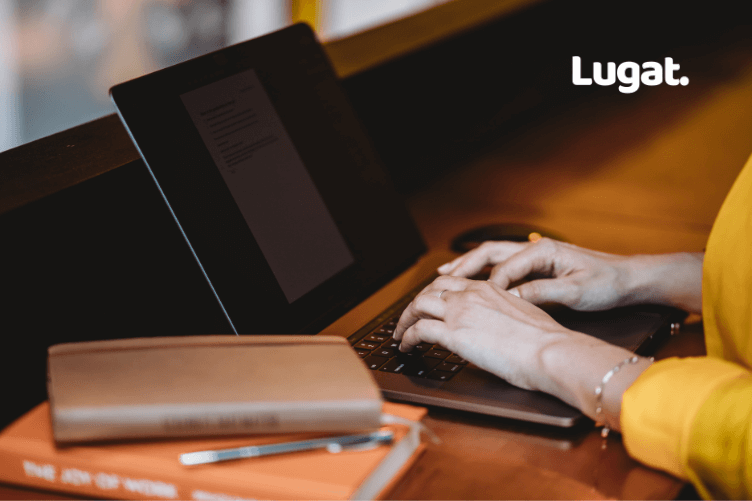
Where is `tan book`? Image resolution: width=752 pixels, height=501 pixels. tan book is located at coordinates (213, 380).